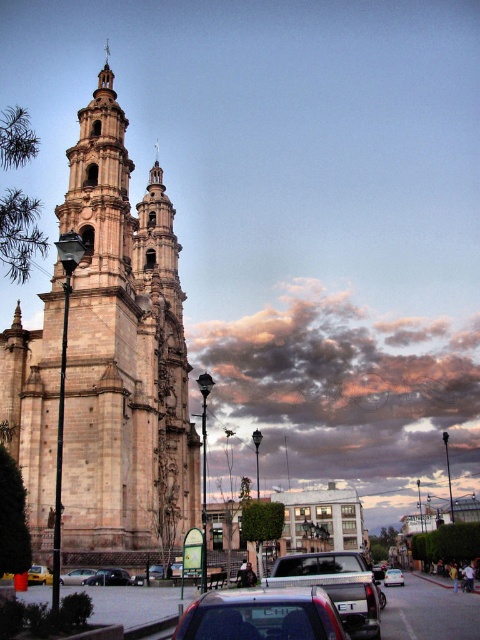
Question: Based on their relative distances, which object is nearer to the shiny black sedan at center?

Choices:
 (A) metallic silver car at center
 (B) matte silver sedan at lower center
 (C) matte silver sedan at center
 (D) beige stone tower at left

Answer: (C)

Question: Does yellow matte taxi at lower left have a greater width compared to metallic silver car at center?

Choices:
 (A) yes
 (B) no

Answer: (B)

Question: Does shiny black sedan at center come behind matte silver sedan at center?

Choices:
 (A) yes
 (B) no

Answer: (A)

Question: Which object appears closest to the camera in this image?

Choices:
 (A) metallic silver car at center
 (B) yellow matte taxi at lower left

Answer: (B)

Question: Which object is the farthest from the metallic silver car at center?

Choices:
 (A) yellow matte taxi at lower left
 (B) shiny black sedan at center

Answer: (A)

Question: Can you confirm if beige stone tower at left is bigger than matte silver sedan at lower center?

Choices:
 (A) no
 (B) yes

Answer: (B)